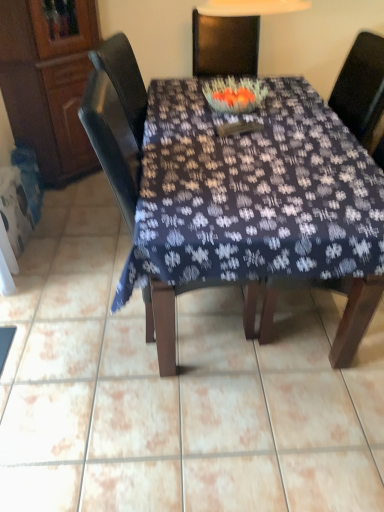
Question: From the image's perspective, is matte dark wood chair at center, the first chair from the left, above wooden cabinet at left?

Choices:
 (A) no
 (B) yes

Answer: (A)

Question: From a real-world perspective, is matte dark wood chair at center, the second chair from the right, positioned under wooden cabinet at left based on gravity?

Choices:
 (A) yes
 (B) no

Answer: (A)

Question: Does matte dark wood chair at center, the second chair from the right, have a greater height compared to wooden cabinet at left?

Choices:
 (A) yes
 (B) no

Answer: (B)

Question: Is the position of matte dark wood chair at center, the second chair from the right, less distant than that of wooden cabinet at left?

Choices:
 (A) no
 (B) yes

Answer: (B)

Question: Is matte dark wood chair at center, the second chair from the right, aimed at wooden cabinet at left?

Choices:
 (A) yes
 (B) no

Answer: (B)

Question: Is wooden cabinet at left surrounded by matte dark wood chair at center, the second chair from the right?

Choices:
 (A) no
 (B) yes

Answer: (A)

Question: From a real-world perspective, is matte dark wood chair at center, the second chair from the right, physically above dark fabric table at center?

Choices:
 (A) no
 (B) yes

Answer: (B)

Question: Is matte dark wood chair at center, the first chair from the left, directly adjacent to dark fabric table at center?

Choices:
 (A) yes
 (B) no

Answer: (B)

Question: From the image's perspective, is matte dark wood chair at center, the first chair from the left, above dark fabric table at center?

Choices:
 (A) yes
 (B) no

Answer: (B)

Question: Is matte dark wood chair at center, the first chair from the left, positioned beyond the bounds of dark fabric table at center?

Choices:
 (A) no
 (B) yes

Answer: (A)

Question: Is matte dark wood chair at center, the first chair from the left, far from dark fabric table at center?

Choices:
 (A) yes
 (B) no

Answer: (B)

Question: Considering the relative positions of matte dark wood chair at center, the first chair from the left, and dark fabric table at center in the image provided, is matte dark wood chair at center, the first chair from the left, to the left of dark fabric table at center from the viewer's perspective?

Choices:
 (A) no
 (B) yes

Answer: (B)

Question: Can you confirm if dark fabric table at center is wider than wooden chair at center, which is counted as the 1th chair, starting from the right?

Choices:
 (A) no
 (B) yes

Answer: (B)